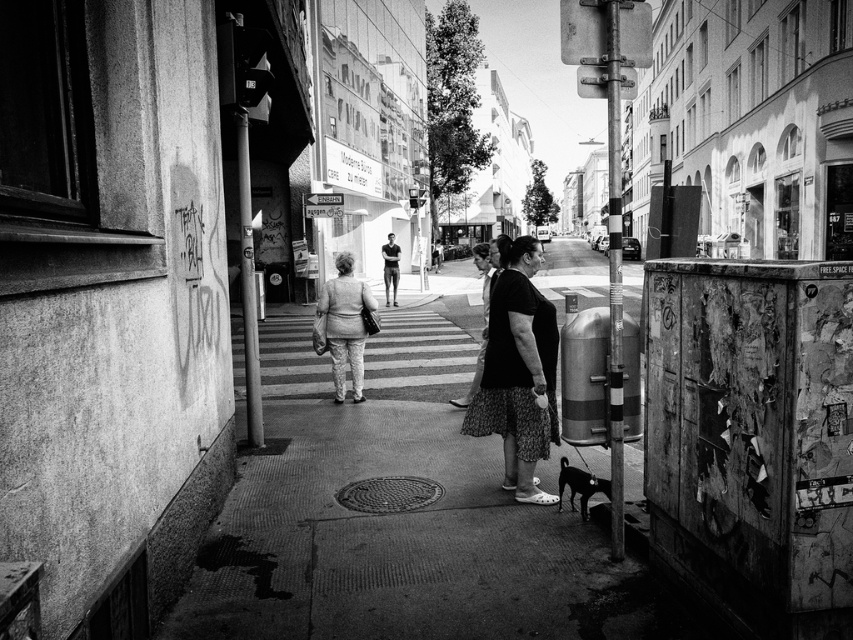
Question: Can you confirm if black textured dress at center is bigger than light gray fabric jacket at center?

Choices:
 (A) yes
 (B) no

Answer: (A)

Question: Can you confirm if black textured dress at center is positioned above light gray fabric jacket at center?

Choices:
 (A) yes
 (B) no

Answer: (A)

Question: Which point is closer to the camera?

Choices:
 (A) black textured dress at center
 (B) light gray fabric jacket at center

Answer: (A)

Question: Can you confirm if black textured dress at center is wider than light gray fabric jacket at center?

Choices:
 (A) no
 (B) yes

Answer: (B)